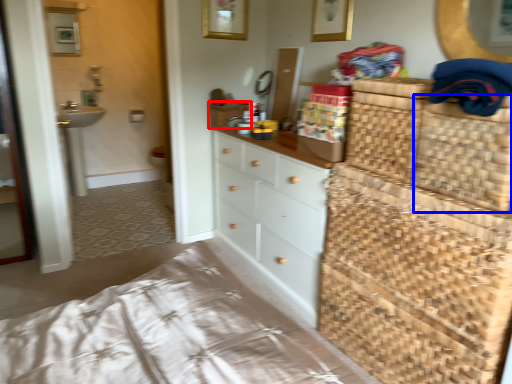
Question: Which object is closer to the camera taking this photo, basket (highlighted by a red box) or basket (highlighted by a blue box)?

Choices:
 (A) basket
 (B) basket

Answer: (B)